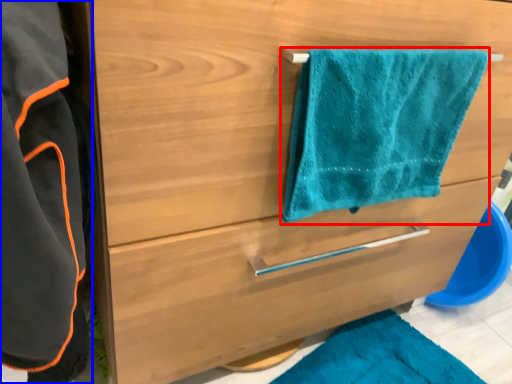
Question: Which point is closer to the camera, towel/napkin (highlighted by a red box) or bathrobe (highlighted by a blue box)?

Choices:
 (A) towel/napkin
 (B) bathrobe

Answer: (B)